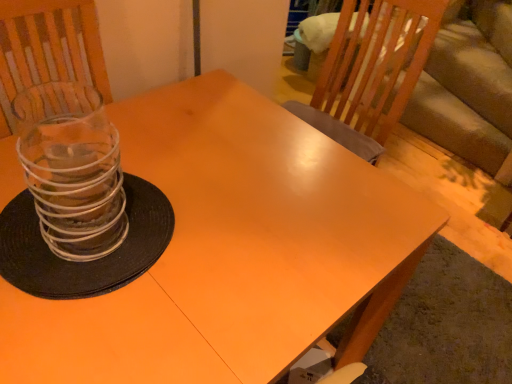
I want to click on free space in front of clear glass candle holder at left, so click(86, 336).